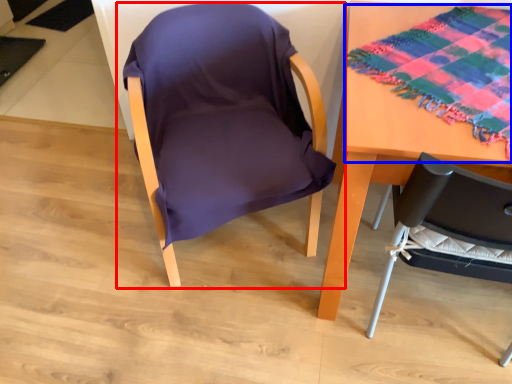
Question: Which of the following is the closest to the observer, chair (highlighted by a red box) or blanket (highlighted by a blue box)?

Choices:
 (A) chair
 (B) blanket

Answer: (B)